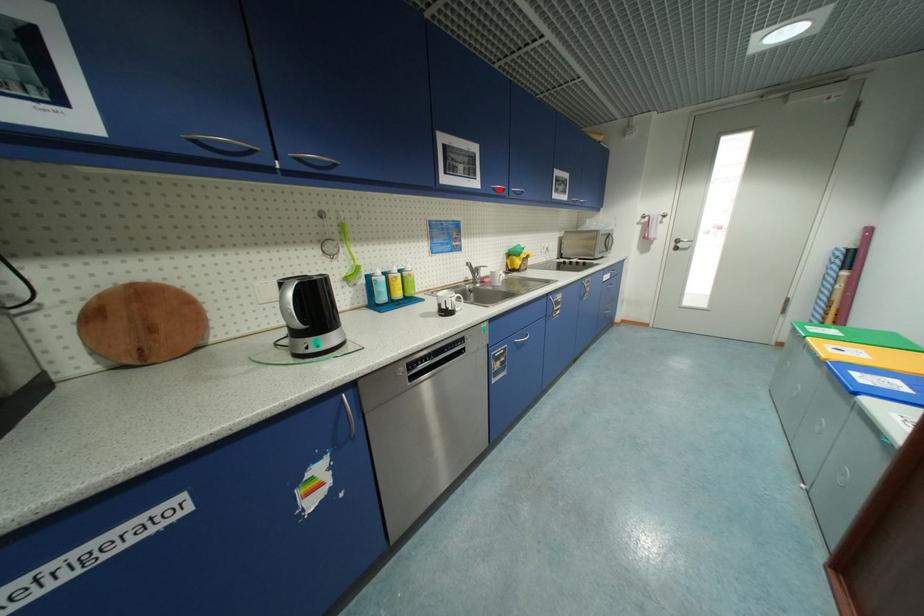
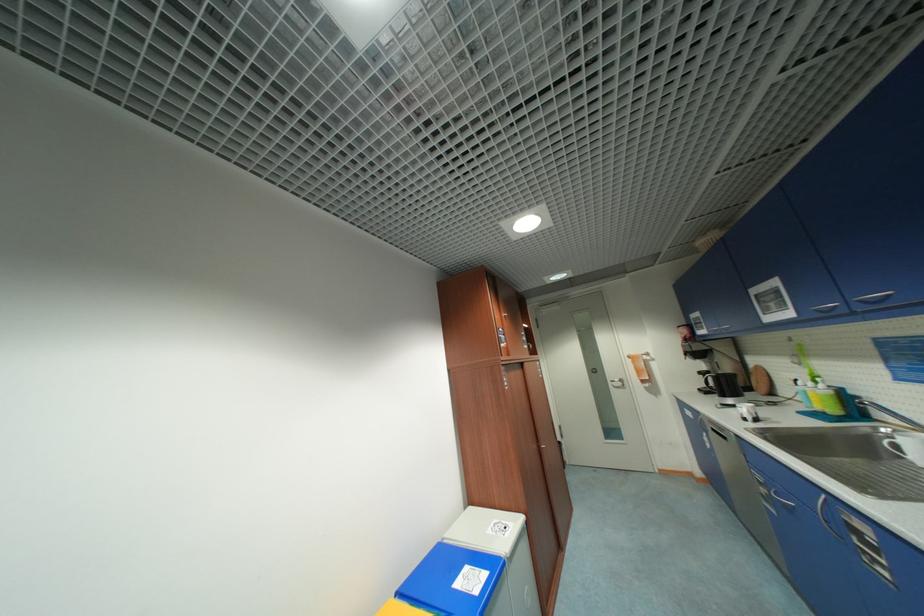
Where in the second image is the point corresponding to the highlighted location from the first image?

(822, 312)